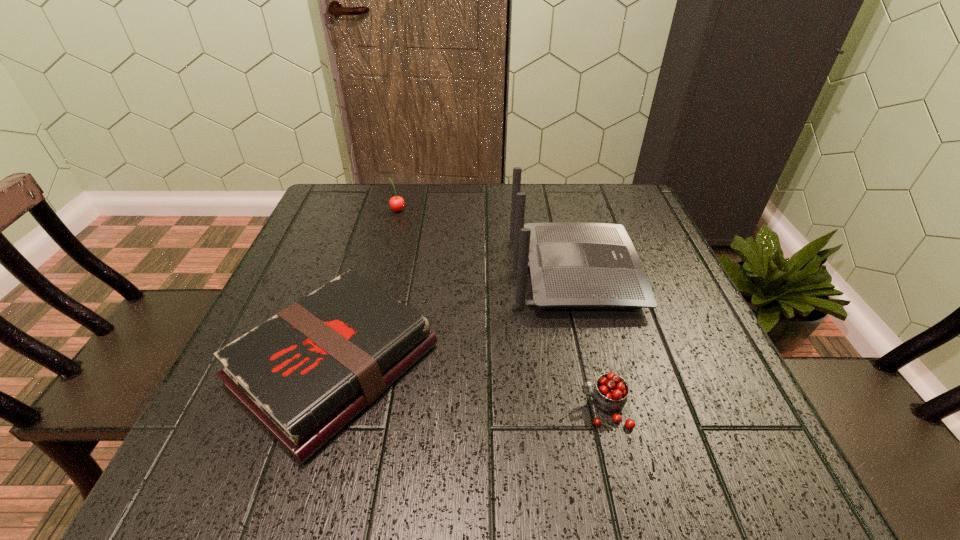
Where is `the tallest object`? the tallest object is located at coordinates (573, 265).

Identify the location of the farthest object. (397, 203).

Image resolution: width=960 pixels, height=540 pixels. What are the coordinates of `the left cherry` in the screenshot? It's located at pos(397,203).

Locate an element on the screen. This screenshot has width=960, height=540. hardback book is located at coordinates (304, 374).

What are the coordinates of `the right cherry` in the screenshot? It's located at (610, 393).

This screenshot has height=540, width=960. I want to click on free location located on the front-facing side of the tallest object, so click(x=671, y=273).

The image size is (960, 540). What are the coordinates of `vacant space positioned on the right of the farthest object` in the screenshot? It's located at (498, 210).

Image resolution: width=960 pixels, height=540 pixels. I want to click on free space located on the back of the hardback book, so (363, 273).

At what (x,y) coordinates should I click in order to perform the action: click on blank area located 0.070m on the handle side of the nearer cherry. Please return your answer as a coordinate pair (x, y). Looking at the image, I should click on (539, 408).

This screenshot has height=540, width=960. In order to click on free space located on the handle side of the nearer cherry in this screenshot , I will do `click(508, 408)`.